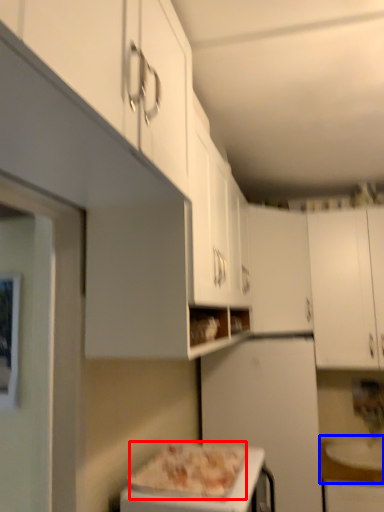
Question: Among these objects, which one is farthest to the camera, pizza (highlighted by a red box) or counter top (highlighted by a blue box)?

Choices:
 (A) pizza
 (B) counter top

Answer: (B)